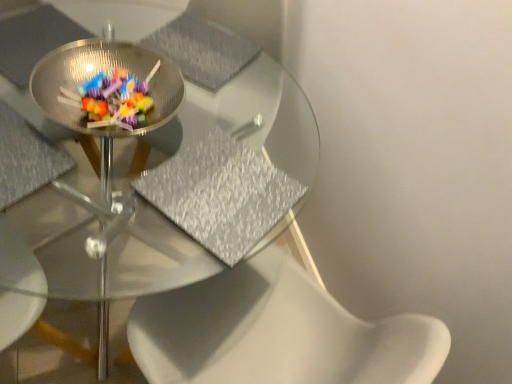
Locate an element on the screen. vacant area on top of transparent glass table at center (from a real-world perspective) is located at coordinates (156, 97).